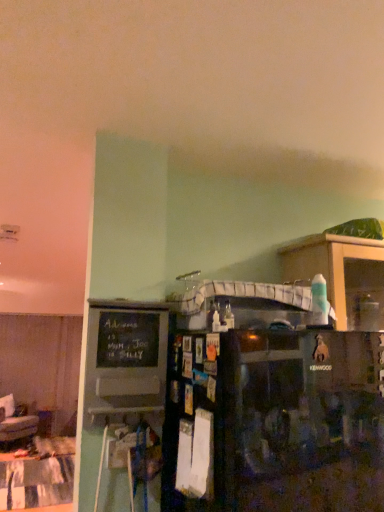
Question: From a real-world perspective, is patchwork fabric table at lower left beneath black matte refrigerator at center?

Choices:
 (A) no
 (B) yes

Answer: (B)

Question: Considering the relative sizes of patchwork fabric table at lower left and black matte refrigerator at center in the image provided, is patchwork fabric table at lower left smaller than black matte refrigerator at center?

Choices:
 (A) no
 (B) yes

Answer: (B)

Question: Is patchwork fabric table at lower left far from black matte refrigerator at center?

Choices:
 (A) yes
 (B) no

Answer: (A)

Question: From a real-world perspective, is patchwork fabric table at lower left over black matte refrigerator at center?

Choices:
 (A) no
 (B) yes

Answer: (A)

Question: From the image's perspective, would you say patchwork fabric table at lower left is shown under black matte refrigerator at center?

Choices:
 (A) yes
 (B) no

Answer: (A)

Question: In terms of height, does black chalkboard at left look taller or shorter compared to patchwork fabric table at lower left?

Choices:
 (A) short
 (B) tall

Answer: (B)

Question: From the image's perspective, is black chalkboard at left above or below patchwork fabric table at lower left?

Choices:
 (A) above
 (B) below

Answer: (A)

Question: Do you think black chalkboard at left is within patchwork fabric table at lower left, or outside of it?

Choices:
 (A) outside
 (B) inside

Answer: (A)

Question: From a real-world perspective, is black chalkboard at left above or below patchwork fabric table at lower left?

Choices:
 (A) below
 (B) above

Answer: (B)

Question: From the image's perspective, is black matte refrigerator at center above or below wooden cabinet at right?

Choices:
 (A) above
 (B) below

Answer: (B)

Question: From a real-world perspective, is black matte refrigerator at center positioned above or below wooden cabinet at right?

Choices:
 (A) above
 (B) below

Answer: (B)

Question: Considering the positions of black matte refrigerator at center and wooden cabinet at right in the image, is black matte refrigerator at center taller or shorter than wooden cabinet at right?

Choices:
 (A) tall
 (B) short

Answer: (A)

Question: Looking at their shapes, would you say black matte refrigerator at center is wider or thinner than wooden cabinet at right?

Choices:
 (A) thin
 (B) wide

Answer: (B)

Question: From a real-world perspective, is black chalkboard at left above or below wooden cabinet at right?

Choices:
 (A) above
 (B) below

Answer: (B)

Question: Would you say black chalkboard at left is to the left or to the right of wooden cabinet at right in the picture?

Choices:
 (A) left
 (B) right

Answer: (A)